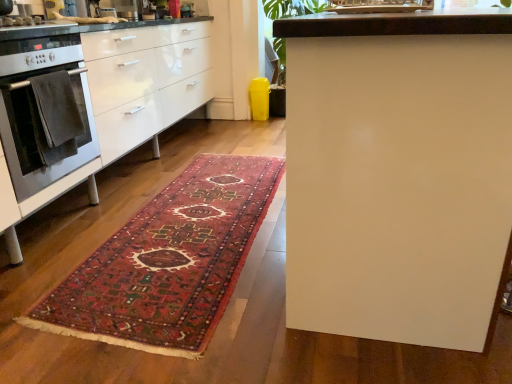
Question: Is carpeted rug at center in front of stainless steel oven at left?

Choices:
 (A) yes
 (B) no

Answer: (A)

Question: Is carpeted rug at center facing towards stainless steel oven at left?

Choices:
 (A) yes
 (B) no

Answer: (B)

Question: Considering the relative sizes of carpeted rug at center and stainless steel oven at left in the image provided, is carpeted rug at center bigger than stainless steel oven at left?

Choices:
 (A) yes
 (B) no

Answer: (B)

Question: From the image's perspective, is carpeted rug at center on top of stainless steel oven at left?

Choices:
 (A) no
 (B) yes

Answer: (A)

Question: Is carpeted rug at center smaller than stainless steel oven at left?

Choices:
 (A) no
 (B) yes

Answer: (B)

Question: From a real-world perspective, is stainless steel oven at left above or below velvety dark gray towel at left?

Choices:
 (A) above
 (B) below

Answer: (A)

Question: Does point (13, 142) appear closer or farther from the camera than point (56, 115)?

Choices:
 (A) closer
 (B) farther

Answer: (A)

Question: In terms of size, does stainless steel oven at left appear bigger or smaller than velvety dark gray towel at left?

Choices:
 (A) small
 (B) big

Answer: (B)

Question: Based on their positions, is stainless steel oven at left located to the left or right of velvety dark gray towel at left?

Choices:
 (A) left
 (B) right

Answer: (A)

Question: From the image's perspective, is carpeted rug at center positioned above or below velvety dark gray towel at left?

Choices:
 (A) below
 (B) above

Answer: (A)

Question: Is point (113, 304) positioned closer to the camera than point (50, 134)?

Choices:
 (A) closer
 (B) farther

Answer: (A)

Question: In terms of height, does carpeted rug at center look taller or shorter compared to velvety dark gray towel at left?

Choices:
 (A) tall
 (B) short

Answer: (B)

Question: Would you say carpeted rug at center is inside or outside velvety dark gray towel at left?

Choices:
 (A) outside
 (B) inside

Answer: (A)

Question: Is carpeted rug at center situated inside stainless steel oven at left or outside?

Choices:
 (A) outside
 (B) inside

Answer: (A)

Question: Considering the positions of carpeted rug at center and stainless steel oven at left in the image, is carpeted rug at center bigger or smaller than stainless steel oven at left?

Choices:
 (A) small
 (B) big

Answer: (A)